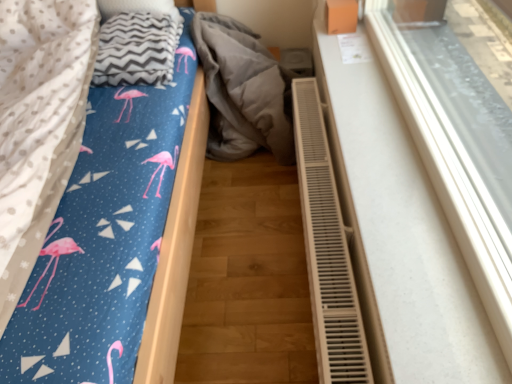
Identify the location of empty space that is ontop of white plastic radiator at lower right (from a real-world perspective). click(x=327, y=193).